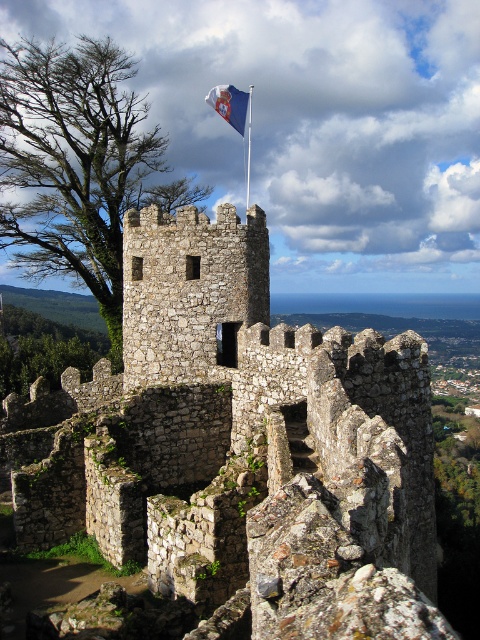
Question: Among these points, which one is farthest from the camera?

Choices:
 (A) 175,372
 (B) 208,93

Answer: (B)

Question: Does stone wall at center have a lesser width compared to blue fabric flag at upper center?

Choices:
 (A) no
 (B) yes

Answer: (A)

Question: Among these points, which one is farthest from the camera?

Choices:
 (A) (232, 109)
 (B) (324, 378)

Answer: (A)

Question: From the image, what is the correct spatial relationship of stone wall at center in relation to blue fabric flag at upper center?

Choices:
 (A) right
 (B) left

Answer: (A)

Question: Is stone wall at center bigger than blue fabric flag at upper center?

Choices:
 (A) no
 (B) yes

Answer: (A)